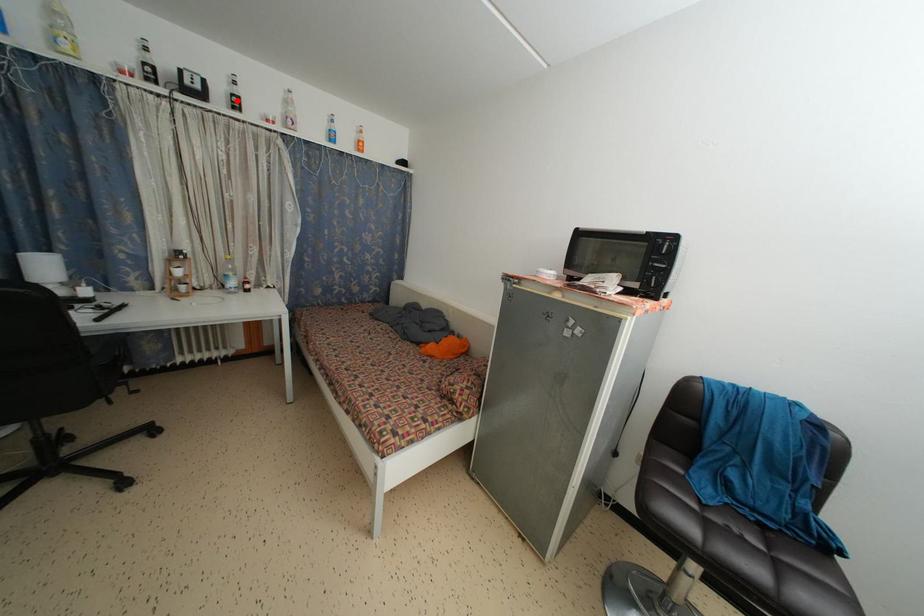
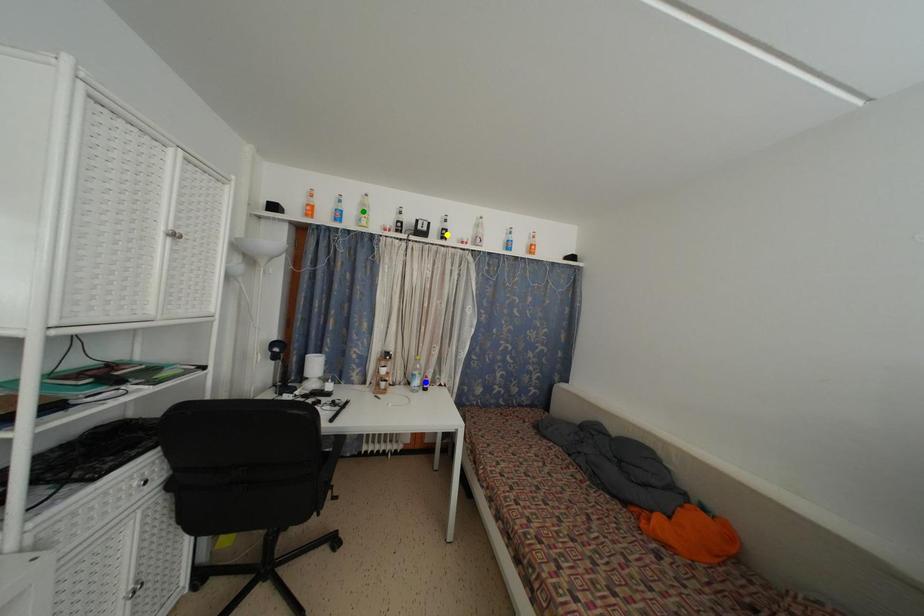
Question: I am providing you with two images of the same scene from different viewpoints. A red point is marked on the first image. You are given multiple points on the second image. Which spot in image 2 lines up with the point in image 1?

Choices:
 (A) green point
 (B) blue point
 (C) yellow point

Answer: (C)